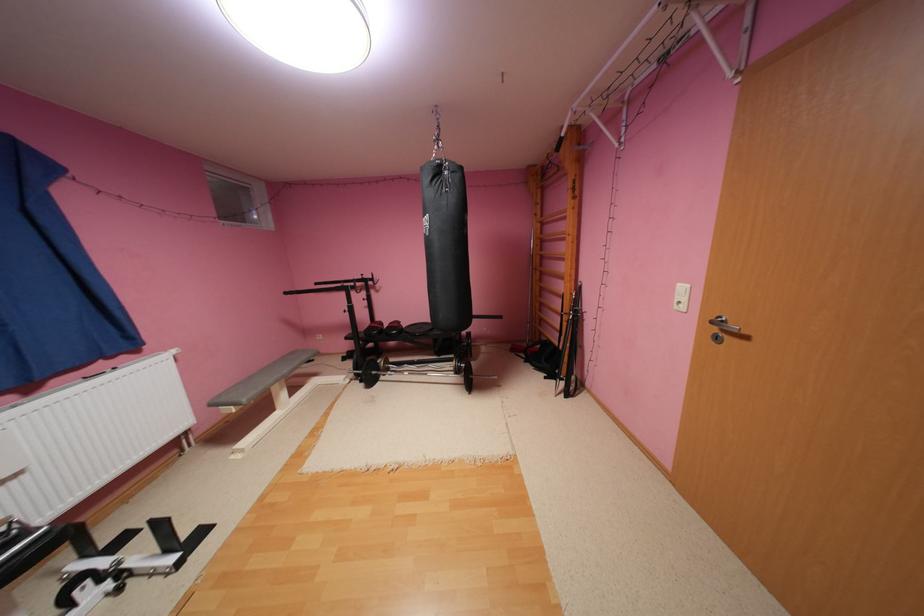
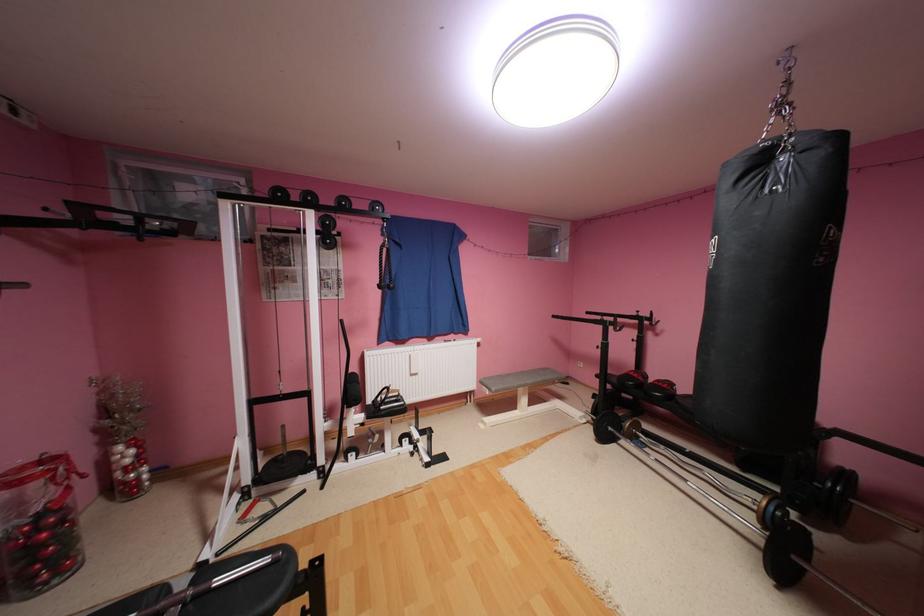
In the second image, find the point that corresponds to (x=478, y=334) in the first image.

(857, 475)